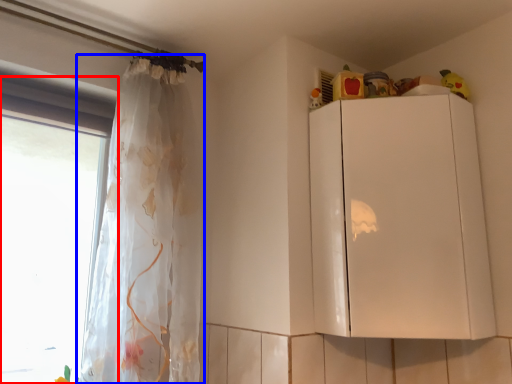
Question: Which object is further to the camera taking this photo, window (highlighted by a red box) or curtain (highlighted by a blue box)?

Choices:
 (A) window
 (B) curtain

Answer: (A)